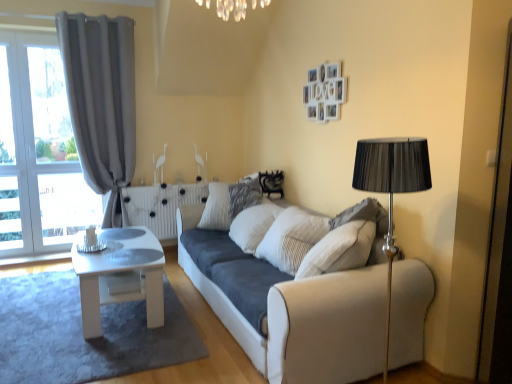
Question: Considering the relative positions of white glossy table at center and suede-like beige pillow at right in the image provided, is white glossy table at center to the right of suede-like beige pillow at right from the viewer's perspective?

Choices:
 (A) no
 (B) yes

Answer: (A)

Question: From a real-world perspective, is white glossy table at center physically below suede-like beige pillow at right?

Choices:
 (A) no
 (B) yes

Answer: (B)

Question: Is white glossy table at center far away from suede-like beige pillow at right?

Choices:
 (A) no
 (B) yes

Answer: (B)

Question: Can you confirm if white glossy table at center is bigger than suede-like beige pillow at right?

Choices:
 (A) yes
 (B) no

Answer: (A)

Question: Considering the relative sizes of white glossy table at center and suede-like beige pillow at right in the image provided, is white glossy table at center smaller than suede-like beige pillow at right?

Choices:
 (A) no
 (B) yes

Answer: (A)

Question: Does white glossy table at center have a greater width compared to suede-like beige pillow at right?

Choices:
 (A) yes
 (B) no

Answer: (A)

Question: Could you tell me if white glossy coffee table at lower left is turned towards suede-like beige pillow at right?

Choices:
 (A) yes
 (B) no

Answer: (B)

Question: Is white glossy coffee table at lower left outside of suede-like beige pillow at right?

Choices:
 (A) yes
 (B) no

Answer: (A)

Question: Considering the relative positions of white glossy coffee table at lower left and suede-like beige pillow at right in the image provided, is white glossy coffee table at lower left in front of suede-like beige pillow at right?

Choices:
 (A) yes
 (B) no

Answer: (A)

Question: Does white glossy coffee table at lower left have a greater height compared to suede-like beige pillow at right?

Choices:
 (A) yes
 (B) no

Answer: (B)

Question: Is white glossy coffee table at lower left placed right next to suede-like beige pillow at right?

Choices:
 (A) yes
 (B) no

Answer: (B)

Question: Is white glossy coffee table at lower left far away from suede-like beige pillow at right?

Choices:
 (A) no
 (B) yes

Answer: (B)

Question: From a real-world perspective, is white fabric couch at center located higher than white glossy coffee table at lower left?

Choices:
 (A) yes
 (B) no

Answer: (A)